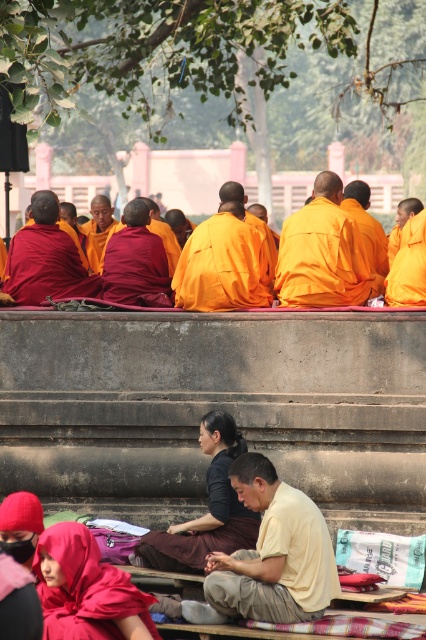
Between yellow matte shirt at center and orange robe monk at center, which one appears on the left side from the viewer's perspective?

Positioned to the left is orange robe monk at center.

This screenshot has height=640, width=426. I want to click on yellow matte shirt at center, so click(x=273, y=552).

Where is `yellow matte shirt at center`? yellow matte shirt at center is located at coordinates (273, 552).

Who is higher up, matte red robe at lower left or orange matte robe at center?

orange matte robe at center is above.

Is point (123, 588) farther from viewer compared to point (227, 241)?

No, it is not.

What do you see at coordinates (86, 589) in the screenshot? I see `matte red robe at lower left` at bounding box center [86, 589].

Where is `matte red robe at lower left`? The image size is (426, 640). matte red robe at lower left is located at coordinates (86, 589).

Between point (302, 268) and point (98, 205), which one is positioned in front?

Point (302, 268)

Is orange cloth at center taller than orange robe monk at center?

In fact, orange cloth at center may be shorter than orange robe monk at center.

At what (x,y) coordinates should I click in order to perform the action: click on orange cloth at center. Please return your answer as a coordinate pair (x, y). Looking at the image, I should click on (324, 253).